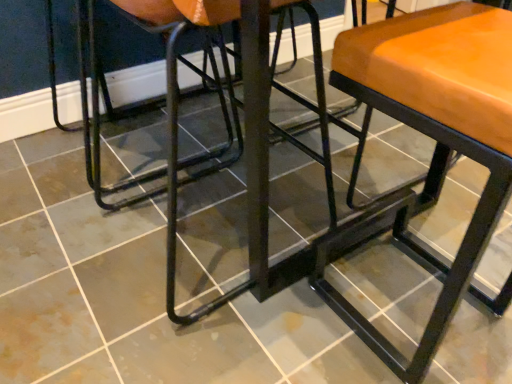
Identify the location of unoccupied space behind matte orange cushioned stool at center. Image resolution: width=512 pixels, height=384 pixels. (381, 233).